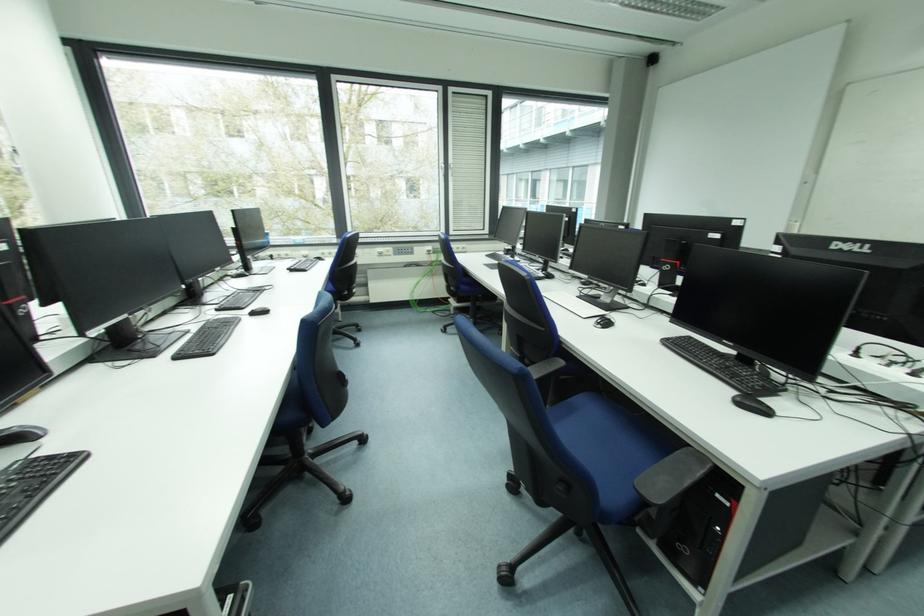
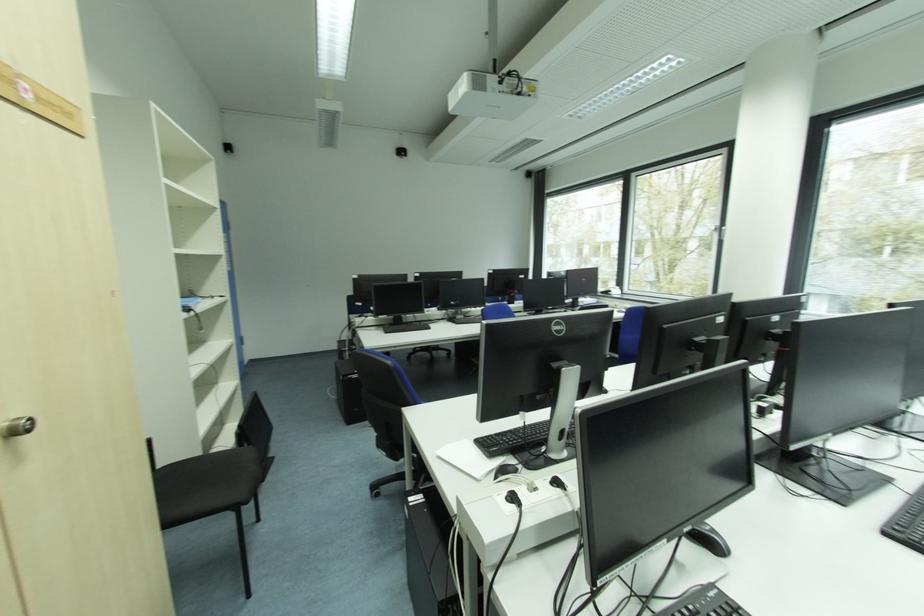
Question: Based on the continuous images, in which direction is the camera rotating? Reply with the corresponding letter.

Choices:
 (A) Left
 (B) Right
 (C) Up
 (D) Down

Answer: (A)